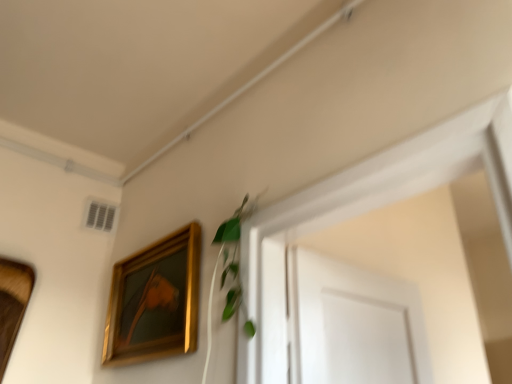
Question: Is green leafy plant at upper center further to camera compared to gold/glossy picture frame at upper left, the 2th picture frame positioned from the left?

Choices:
 (A) yes
 (B) no

Answer: (B)

Question: Is green leafy plant at upper center positioned in front of gold/glossy picture frame at upper left, the 2th picture frame positioned from the left?

Choices:
 (A) yes
 (B) no

Answer: (A)

Question: Does green leafy plant at upper center have a lesser width compared to gold/glossy picture frame at upper left, the 1th picture frame when ordered from right to left?

Choices:
 (A) yes
 (B) no

Answer: (A)

Question: Could you tell me if green leafy plant at upper center is facing gold/glossy picture frame at upper left, the 1th picture frame when ordered from right to left?

Choices:
 (A) no
 (B) yes

Answer: (A)

Question: Is green leafy plant at upper center shorter than gold/glossy picture frame at upper left, the 2th picture frame positioned from the left?

Choices:
 (A) yes
 (B) no

Answer: (A)

Question: Looking at their shapes, would you say green leafy plant at upper center is wider or thinner than gold/glossy picture frame at upper left, the 1th picture frame when ordered from right to left?

Choices:
 (A) thin
 (B) wide

Answer: (A)

Question: Is green leafy plant at upper center to the left or to the right of gold/glossy picture frame at upper left, the 1th picture frame when ordered from right to left, in the image?

Choices:
 (A) right
 (B) left

Answer: (A)

Question: From a real-world perspective, relative to gold/glossy picture frame at upper left, the 2th picture frame positioned from the left, is green leafy plant at upper center vertically above or below?

Choices:
 (A) below
 (B) above

Answer: (B)

Question: Is green leafy plant at upper center taller or shorter than gold/glossy picture frame at upper left, the 1th picture frame when ordered from right to left?

Choices:
 (A) tall
 (B) short

Answer: (B)

Question: Is wooden picture frame at left, arranged as the 2th picture frame when viewed from the right, taller or shorter than gold/glossy picture frame at upper left, the 1th picture frame when ordered from right to left?

Choices:
 (A) short
 (B) tall

Answer: (B)

Question: From the image's perspective, is wooden picture frame at left, arranged as the 2th picture frame when viewed from the right, above or below gold/glossy picture frame at upper left, the 1th picture frame when ordered from right to left?

Choices:
 (A) below
 (B) above

Answer: (A)

Question: Is wooden picture frame at left, arranged as the 2th picture frame when viewed from the right, to the left or to the right of gold/glossy picture frame at upper left, the 1th picture frame when ordered from right to left, in the image?

Choices:
 (A) right
 (B) left

Answer: (B)

Question: Based on their sizes in the image, would you say wooden picture frame at left, the first picture frame viewed from the left, is bigger or smaller than gold/glossy picture frame at upper left, the 1th picture frame when ordered from right to left?

Choices:
 (A) big
 (B) small

Answer: (B)

Question: Is point [175, 350] positioned closer to the camera than point [237, 266]?

Choices:
 (A) closer
 (B) farther

Answer: (B)

Question: Considering the positions of gold/glossy picture frame at upper left, the 1th picture frame when ordered from right to left, and green leafy plant at upper center in the image, is gold/glossy picture frame at upper left, the 1th picture frame when ordered from right to left, bigger or smaller than green leafy plant at upper center?

Choices:
 (A) big
 (B) small

Answer: (A)